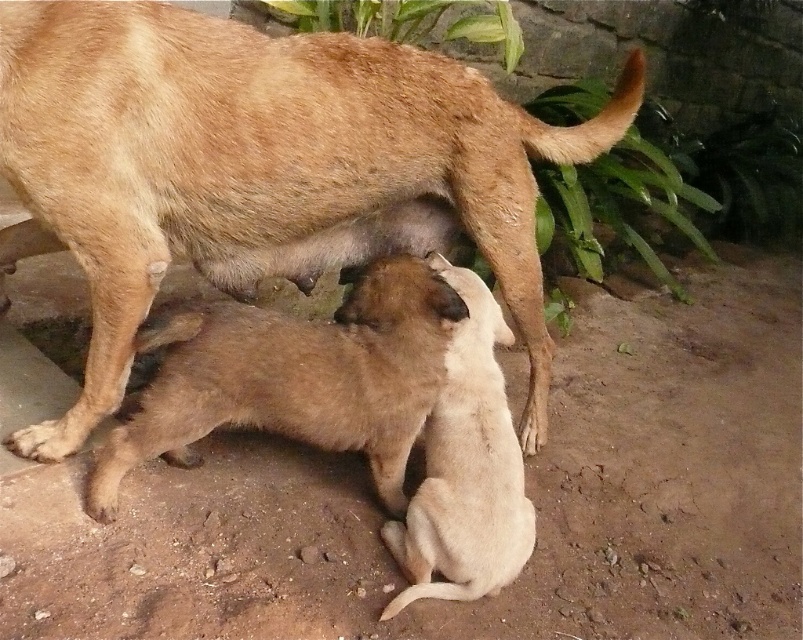
Does brown fur dog at center lie in front of light brown fur at center?

Yes, brown fur dog at center is in front of light brown fur at center.

How much distance is there between brown fur dog at center and light brown fur at center?

18.51 inches

In order to click on brown fur dog at center in this screenshot , I will do `click(259, 168)`.

The image size is (803, 640). I want to click on brown furry pup at center, so tap(294, 378).

Does brown furry pup at center have a smaller size compared to light brown fur at center?

Actually, brown furry pup at center might be larger than light brown fur at center.

The height and width of the screenshot is (640, 803). What do you see at coordinates (294, 378) in the screenshot?
I see `brown furry pup at center` at bounding box center [294, 378].

Locate an element on the screen. brown furry pup at center is located at coordinates (294, 378).

Is point (121, 16) less distant than point (117, 436)?

Yes, point (121, 16) is closer to viewer.

Does point (176, 198) come behind point (394, 436)?

No, it is not.

What are the coordinates of `brown fur dog at center` in the screenshot? It's located at (259, 168).